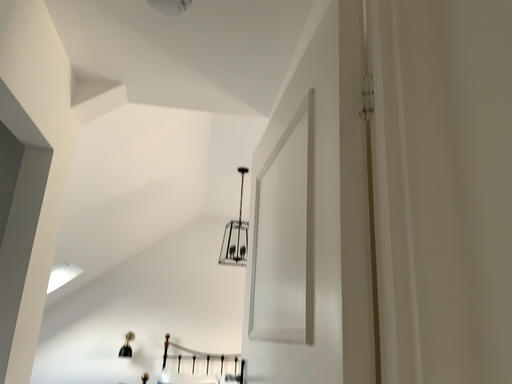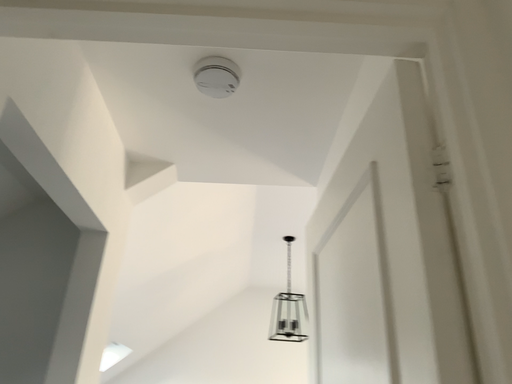
Question: Which way did the camera rotate in the video?

Choices:
 (A) rotated downward
 (B) rotated upward

Answer: (B)